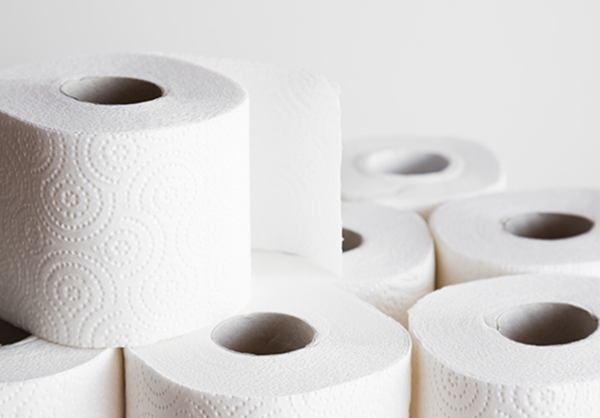
You are a GUI agent. You are given a task and a screenshot of the screen. Output one action in this format:
    pyautogui.click(x=<x>, y=<y>)
    Task: Click on the cardboard roll core
    The height and width of the screenshot is (418, 600).
    Given the screenshot: What is the action you would take?
    pyautogui.click(x=108, y=82), pyautogui.click(x=244, y=326), pyautogui.click(x=546, y=319), pyautogui.click(x=538, y=219), pyautogui.click(x=408, y=163), pyautogui.click(x=348, y=237), pyautogui.click(x=10, y=335)